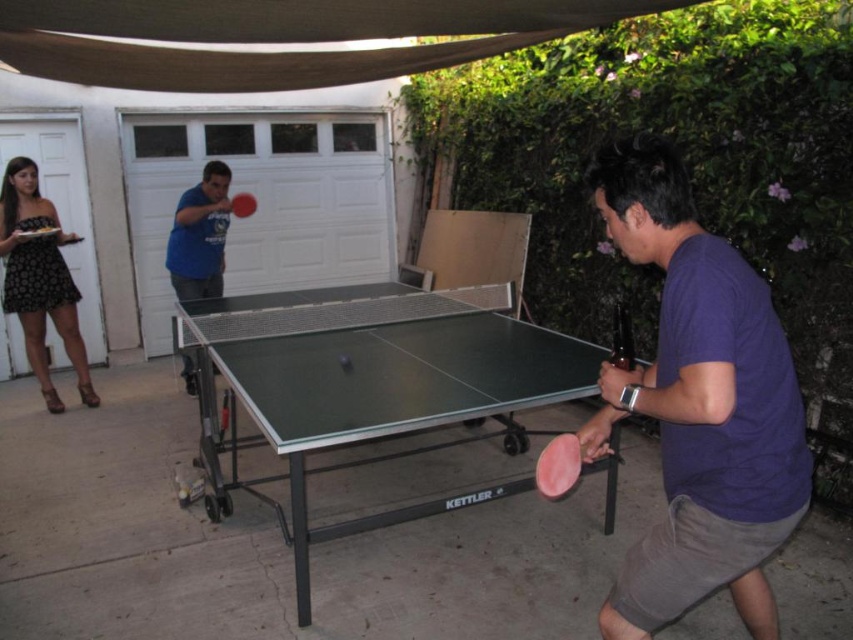
Question: Which object is closer to the camera taking this photo?

Choices:
 (A) purple matte shirt at right
 (B) black lace dress at left
 (C) pink rubber paddle at center

Answer: (A)

Question: Can you confirm if black lace dress at left is wider than pink rubber paddle at center?

Choices:
 (A) yes
 (B) no

Answer: (A)

Question: Is green rubber table tennis table at center positioned in front of blue matte ping pong paddle at center?

Choices:
 (A) yes
 (B) no

Answer: (A)

Question: Which point is closer to the camera taking this photo?

Choices:
 (A) (654, 384)
 (B) (48, 214)
 (C) (167, 150)

Answer: (A)

Question: Which point is closer to the camera taking this photo?

Choices:
 (A) (254, 435)
 (B) (254, 205)
 (C) (0, 204)
 (D) (252, 172)

Answer: (A)

Question: Is purple matte shirt at right thinner than white matte garage door at center?

Choices:
 (A) no
 (B) yes

Answer: (B)